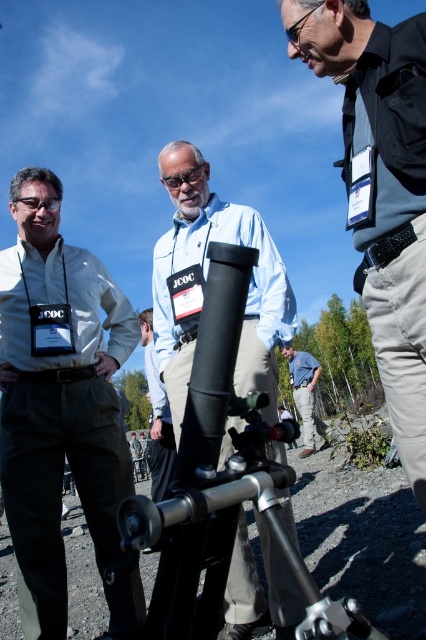
You are a photographer trying to capture a closeup of the matte black goggles at center and the matte khaki pants at left. Which object should you focus on first if you want to ensure both are in focus?

The matte khaki pants at left is positioned under the matte black goggles at center, so focusing on the matte black goggles at center first will ensure both are in focus as they are vertically aligned.

You are an astronomer preparing to observe stars through the telescope. You have the matte black telescope at center and the matte black goggles at center. Which object is wider?

The matte black telescope at center is wider than the matte black goggles at center.

You are an astronomer observing the scene. You notice the black matte shirt at upper right and the matte black telescope at center. Which object is taller in the image?

The black matte shirt at upper right is taller than the matte black telescope at center.